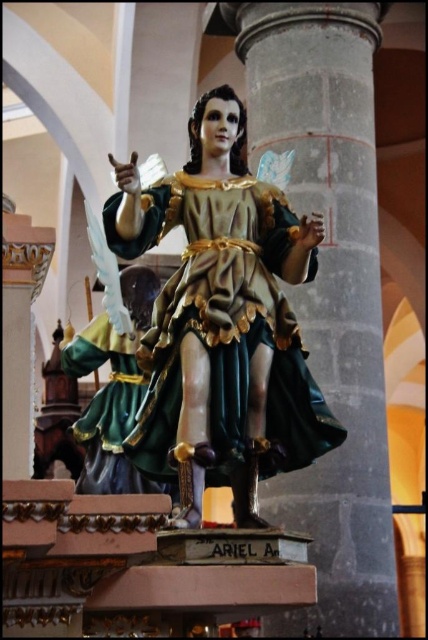
You are an art conservator assessing the space between the gray stone column at center and the polychrome wood statue at center. Based on their widths, can you determine if the statue can be moved to the column without touching it?

The gray stone column at center might be wider than polychrome wood statue at center, so there is a possibility that the statue can be moved to the column without touching it, but the exact width difference is uncertain.

You are an architect designing a new church and want to place a gray stone column at center and a polychrome wood statue at center in the same area. Based on the image, which object should be placed higher to maintain the visual hierarchy?

The gray stone column at center is taller than the polychrome wood statue at center, so to maintain the visual hierarchy, the gray stone column at center should be placed higher than the polychrome wood statue at center.

You are an art restorer working in the cathedral. You need to move a ladder from the gray stone column at center to the polychrome wood statue at center. Which direction should you move the ladder towards?

The gray stone column at center is to the right of the polychrome wood statue at center, so you should move the ladder towards the left to reach the statue.